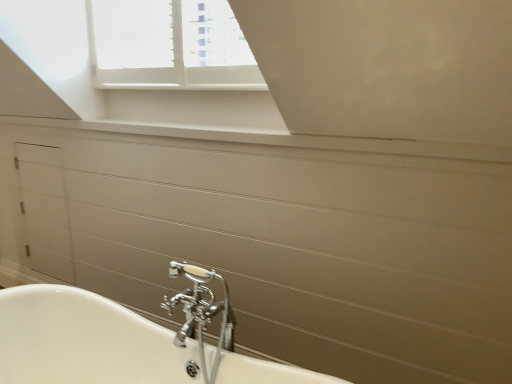
Question: Considering their positions, is chrome metallic faucet at lower center located in front of or behind white glossy drawer at left?

Choices:
 (A) behind
 (B) front

Answer: (B)

Question: Looking at the image, does chrome metallic faucet at lower center seem bigger or smaller compared to white glossy drawer at left?

Choices:
 (A) small
 (B) big

Answer: (A)

Question: Would you say chrome metallic faucet at lower center is to the left or to the right of white glossy drawer at left in the picture?

Choices:
 (A) right
 (B) left

Answer: (A)

Question: Is white glossy drawer at left spatially inside chrome metallic faucet at lower center, or outside of it?

Choices:
 (A) outside
 (B) inside

Answer: (A)

Question: Looking at the image, does white glossy drawer at left seem bigger or smaller compared to chrome metallic faucet at lower center?

Choices:
 (A) big
 (B) small

Answer: (A)

Question: From the image's perspective, is white glossy drawer at left located above or below chrome metallic faucet at lower center?

Choices:
 (A) above
 (B) below

Answer: (A)

Question: Considering their positions, is white glossy drawer at left located in front of or behind chrome metallic faucet at lower center?

Choices:
 (A) behind
 (B) front

Answer: (A)